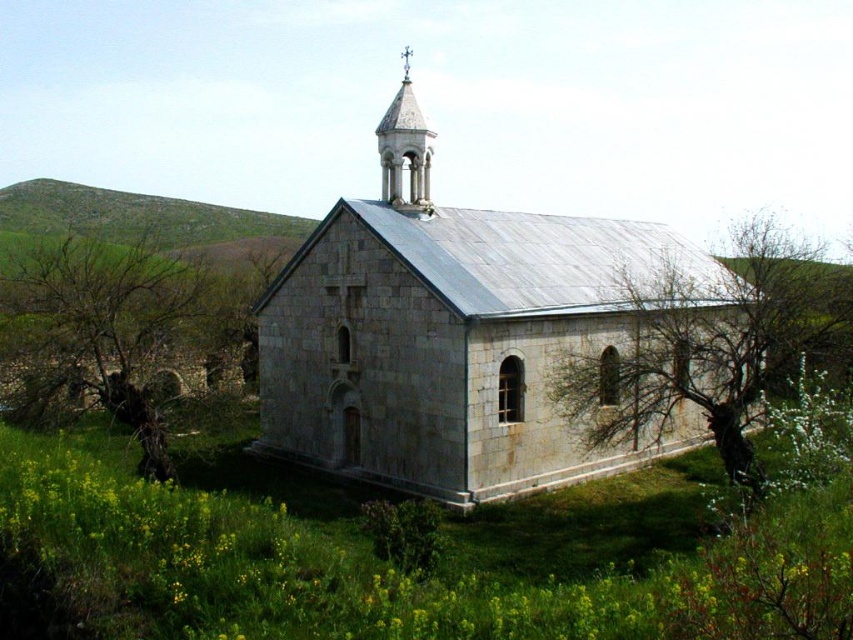
From the picture: Which of these two, gray stone church at center or white stone spire at upper center, stands taller?

gray stone church at center

Locate an element on the screen. gray stone church at center is located at coordinates (469, 344).

Between brown rough tree at lower left and bare branches at right, which one appears on the right side from the viewer's perspective?

Positioned to the right is bare branches at right.

Does brown rough tree at lower left appear on the left side of bare branches at right?

Correct, you'll find brown rough tree at lower left to the left of bare branches at right.

Does point (202, 381) lie behind point (636, 324)?

Yes, it is.

You are a GUI agent. You are given a task and a screenshot of the screen. Output one action in this format:
    pyautogui.click(x=<x>, y=<y>)
    Task: Click on the brown rough tree at lower left
    This screenshot has height=640, width=853.
    Given the screenshot: What is the action you would take?
    pyautogui.click(x=126, y=337)

Is gray stone church at center above brown rough tree at lower left?

No, gray stone church at center is not above brown rough tree at lower left.

What are the coordinates of `gray stone church at center` in the screenshot? It's located at (469, 344).

The height and width of the screenshot is (640, 853). Find the location of `gray stone church at center`. gray stone church at center is located at coordinates (469, 344).